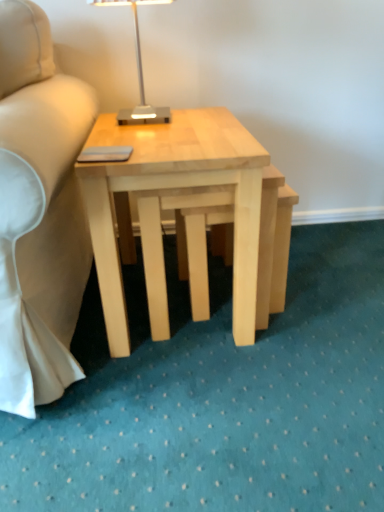
The image size is (384, 512). In order to click on free spot in front of metallic silver table lamp at upper center in this screenshot , I will do `click(151, 137)`.